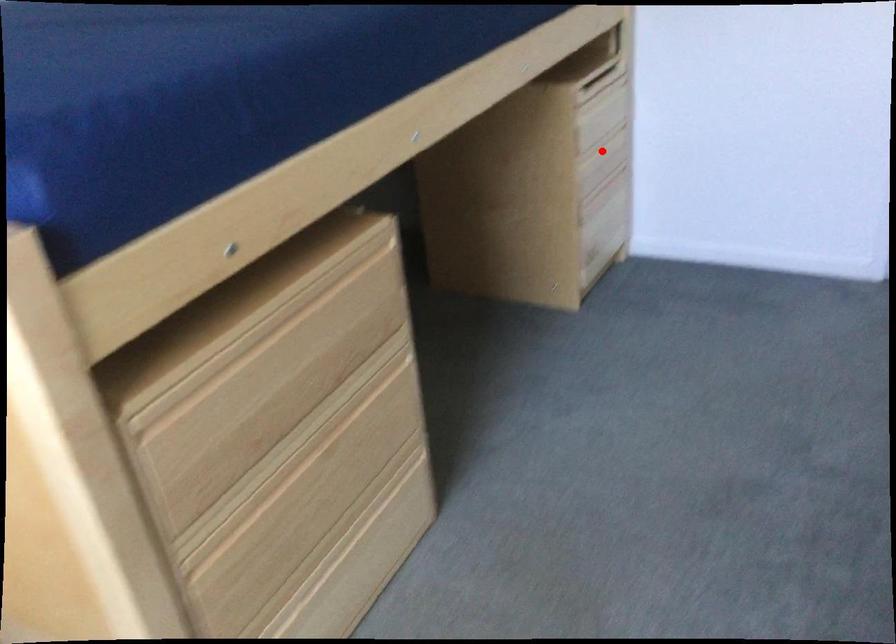
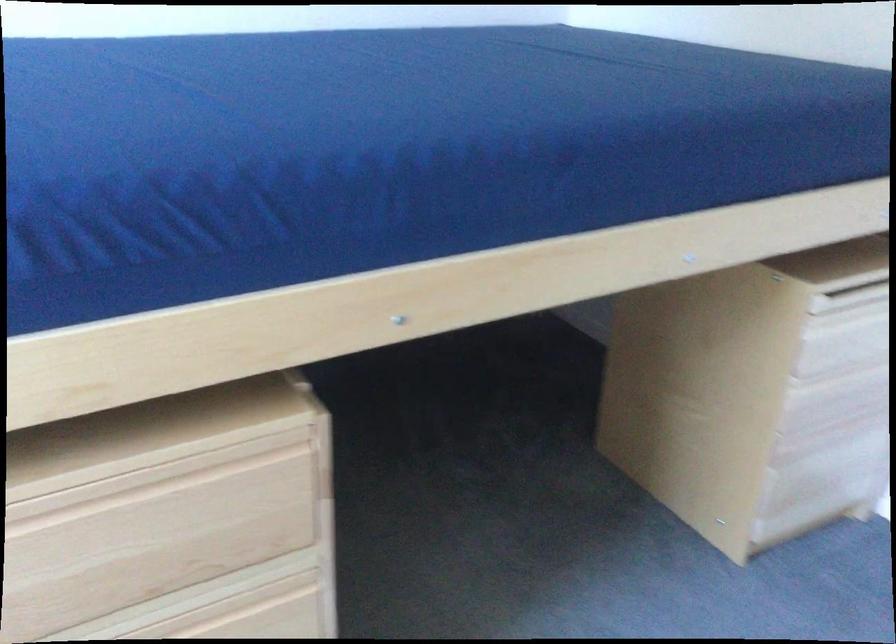
Question: I am providing you with two images of the same scene from different viewpoints. Image1 has a red point marked. In image2, the corresponding 3D location appears at what relative position? Reply with the corresponding letter.

Choices:
 (A) Closer
 (B) Farther

Answer: (A)